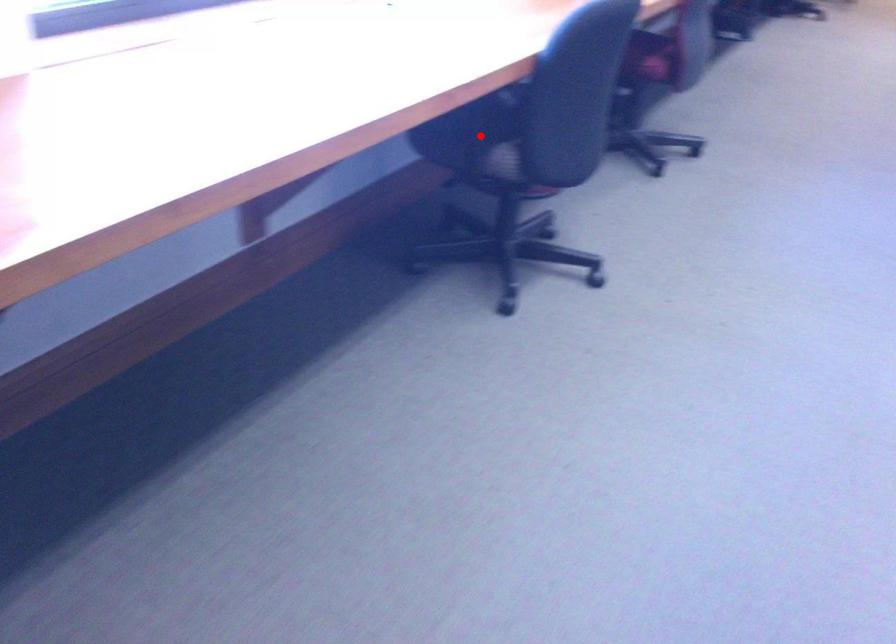
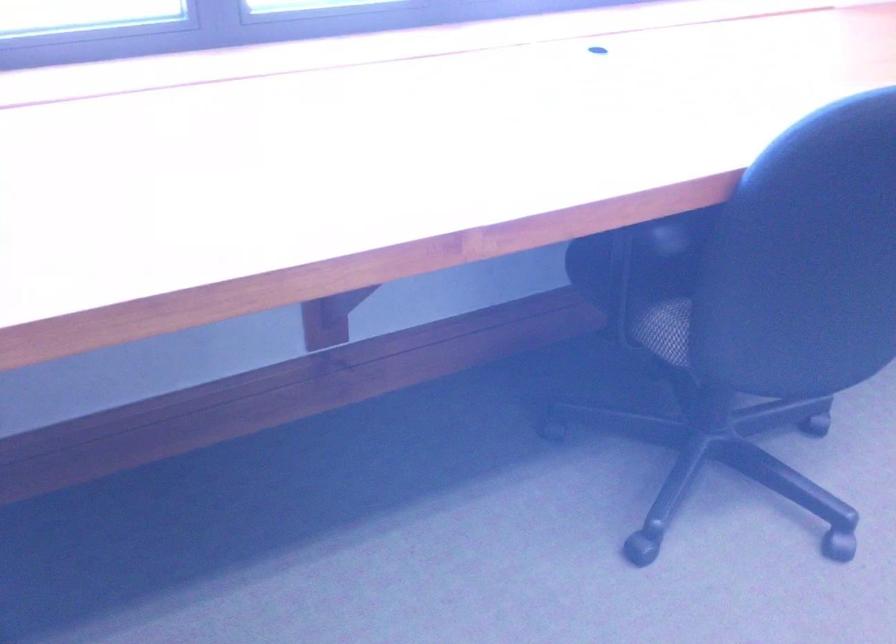
Find the pixel in the second image that matches the highlighted location in the first image.

(645, 279)